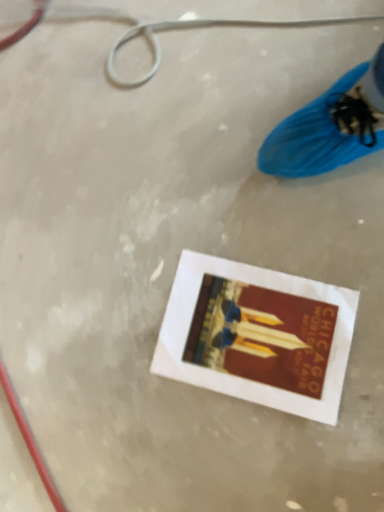
The image size is (384, 512). In order to click on matte paper flyer at center in this screenshot , I will do `click(257, 335)`.

What is the approximate height of matte paper flyer at center?

matte paper flyer at center is 1.00 centimeters in height.

Image resolution: width=384 pixels, height=512 pixels. Describe the element at coordinates (257, 335) in the screenshot. I see `matte paper flyer at center` at that location.

Image resolution: width=384 pixels, height=512 pixels. Find the location of `matte paper flyer at center`. matte paper flyer at center is located at coordinates (257, 335).